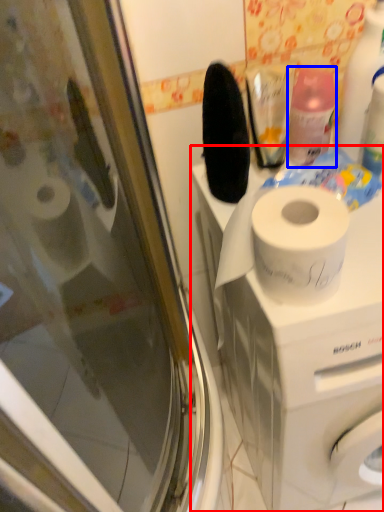
Question: Among these objects, which one is nearest to the camera, washing machine (highlighted by a red box) or cleaning product (highlighted by a blue box)?

Choices:
 (A) washing machine
 (B) cleaning product

Answer: (A)